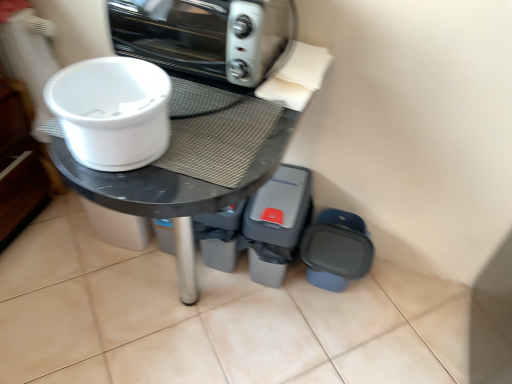
This screenshot has width=512, height=384. What are the coordinates of `vacant space situated on the left part of matte black table at center` in the screenshot? It's located at (67, 280).